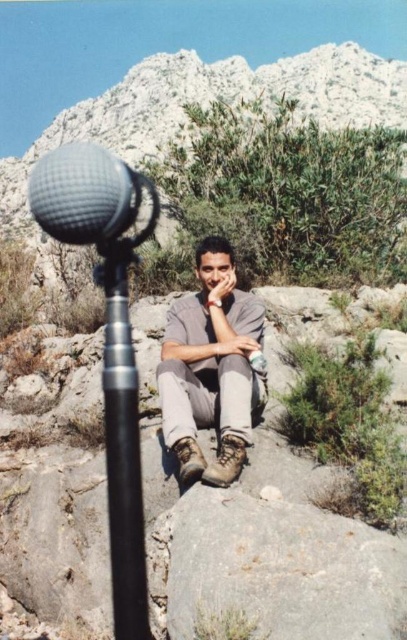
Does gray matte shirt at center have a smaller size compared to black metallic pole at center?

No, gray matte shirt at center is not smaller than black metallic pole at center.

Between gray matte shirt at center and black metallic pole at center, which one has less height?

Standing shorter between the two is gray matte shirt at center.

Which is behind, point (258, 326) or point (113, 358)?

Point (258, 326)

The image size is (407, 640). What are the coordinates of `gray matte shirt at center` in the screenshot? It's located at (212, 369).

Is black metallic pole at center in front of textured gray microphone at left?

No, black metallic pole at center is further to the viewer.

Does black metallic pole at center have a lesser width compared to textured gray microphone at left?

Yes, black metallic pole at center is thinner than textured gray microphone at left.

Does point (109, 417) come in front of point (43, 212)?

No.

Find the location of `black metallic pole at center`. black metallic pole at center is located at coordinates (122, 452).

Can you confirm if gray matte shirt at center is thinner than textured gray microphone at left?

Correct, gray matte shirt at center's width is less than textured gray microphone at left's.

Is gray matte shirt at center closer to the viewer compared to textured gray microphone at left?

No.

Locate an element on the screen. The height and width of the screenshot is (640, 407). gray matte shirt at center is located at coordinates (212, 369).